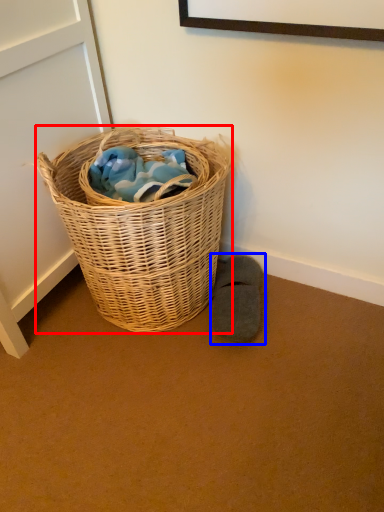
Question: Among these objects, which one is farthest to the camera, picnic basket (highlighted by a red box) or footwear (highlighted by a blue box)?

Choices:
 (A) picnic basket
 (B) footwear

Answer: (B)